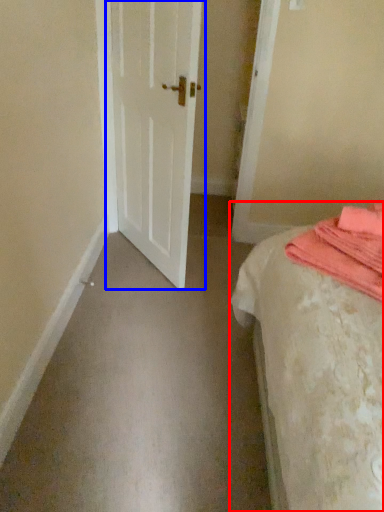
Question: Which point is further to the camera, bed (highlighted by a red box) or door (highlighted by a blue box)?

Choices:
 (A) bed
 (B) door

Answer: (B)